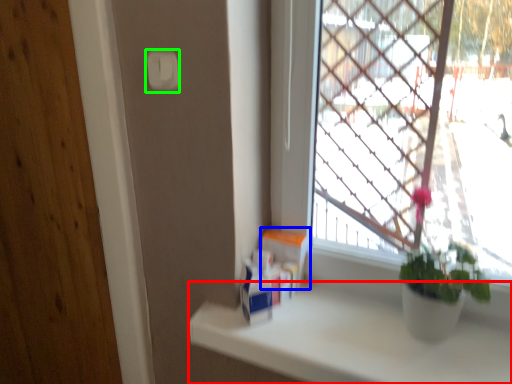
Question: Which object is the farthest from counter top (highlighted by a red box)? Choose among these: window box (highlighted by a blue box) or light switch (highlighted by a green box).

Choices:
 (A) window box
 (B) light switch

Answer: (B)